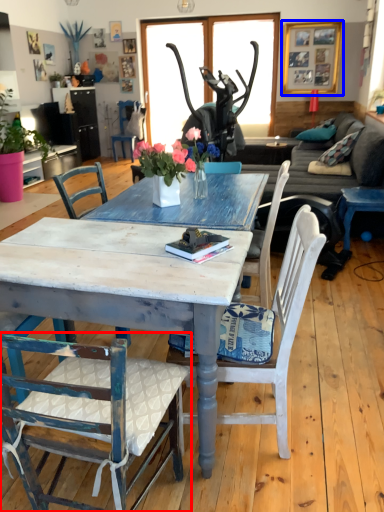
Question: Which object is closer to the camera taking this photo, chair (highlighted by a red box) or picture frame (highlighted by a blue box)?

Choices:
 (A) chair
 (B) picture frame

Answer: (A)